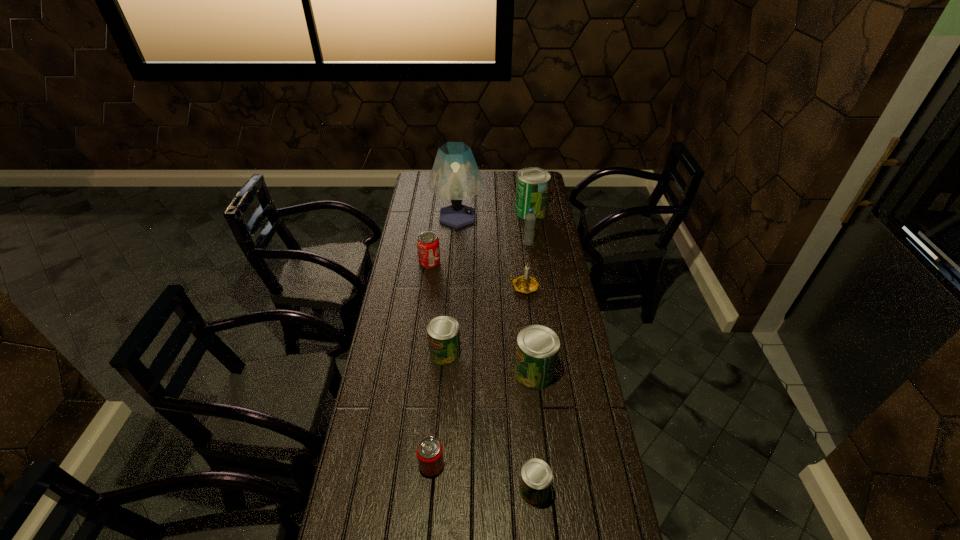
The height and width of the screenshot is (540, 960). Identify the location of the tallest object. (455, 176).

Image resolution: width=960 pixels, height=540 pixels. I want to click on light lampshade, so click(x=455, y=176).

Find the location of a particular element. the farthest can is located at coordinates (532, 188).

The width and height of the screenshot is (960, 540). In order to click on the farthest green can in this screenshot , I will do `click(532, 188)`.

Image resolution: width=960 pixels, height=540 pixels. Find the location of `blue water bottle`. blue water bottle is located at coordinates (530, 219).

Locate an element on the screen. This screenshot has height=540, width=960. the seventh nearest object is located at coordinates (530, 219).

At what (x,y) coordinates should I click in order to perform the action: click on the fifth shortest can. Please return your answer as a coordinate pair (x, y). This screenshot has height=540, width=960. Looking at the image, I should click on (537, 350).

The height and width of the screenshot is (540, 960). I want to click on the fifth nearest can, so pos(428,249).

Locate an element on the screen. The image size is (960, 540). the bigger red can is located at coordinates (428, 249).

Locate an element on the screen. The height and width of the screenshot is (540, 960). the third biggest green can is located at coordinates (443, 332).